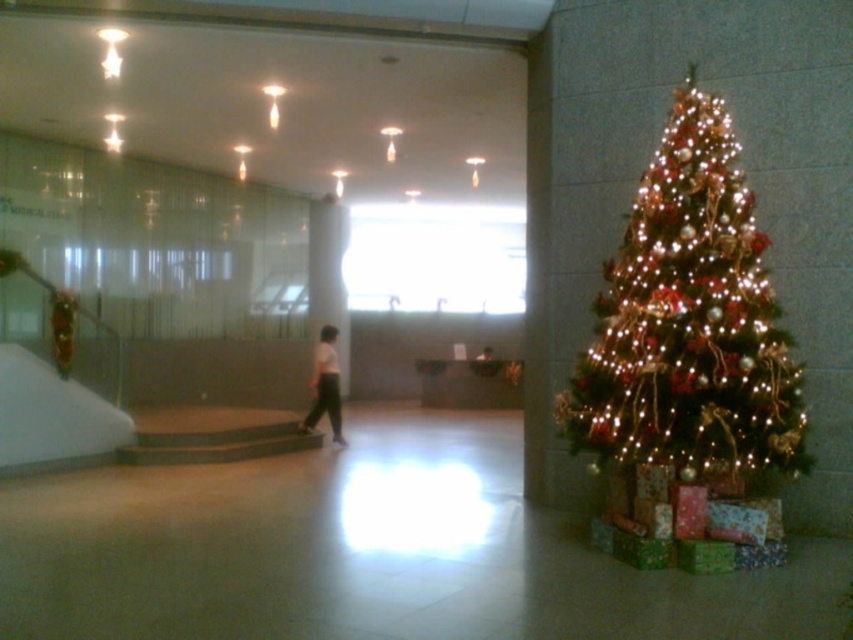
From the picture: You are a photographer setting up a shoot in the lobby. You need to position a tripod so that both the iridescent gold christmas tree at right and the white matte pants at center are in frame. Based on their positions, which object should be placed closer to the camera to ensure both are visible without moving the tripod?

The white matte pants at center should be placed closer to the camera because the iridescent gold christmas tree at right is located above it, meaning the pants are lower and closer to the camera.

You are standing in the lobby and see a point marked at coordinates (x=688, y=321). Based on the scene, where is this point located?

The point at coordinates (x=688, y=321) is located on the iridescent gold christmas tree at right.